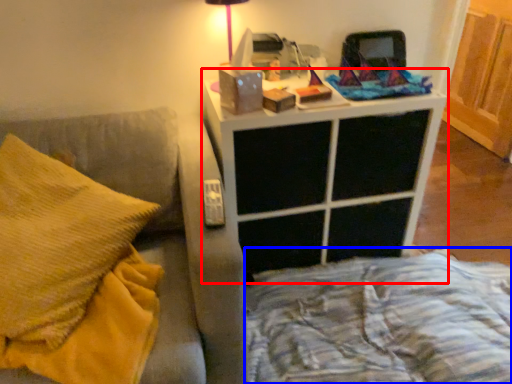
Question: Which of the following is the farthest to the observer, nightstand (highlighted by a red box) or bed frame (highlighted by a blue box)?

Choices:
 (A) nightstand
 (B) bed frame

Answer: (A)